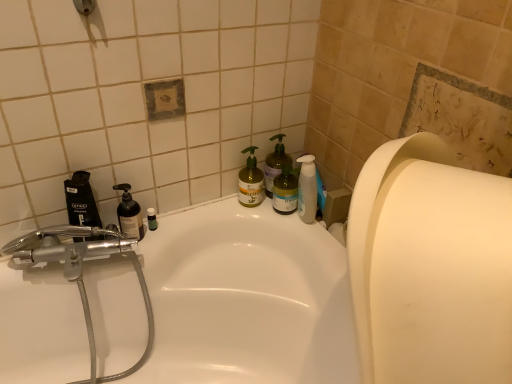
Locate an element on the screen. vacant space in between transparent plastic bottle at left and green matte bottle at center, the second cleaning product viewed from the right is located at coordinates click(x=204, y=217).